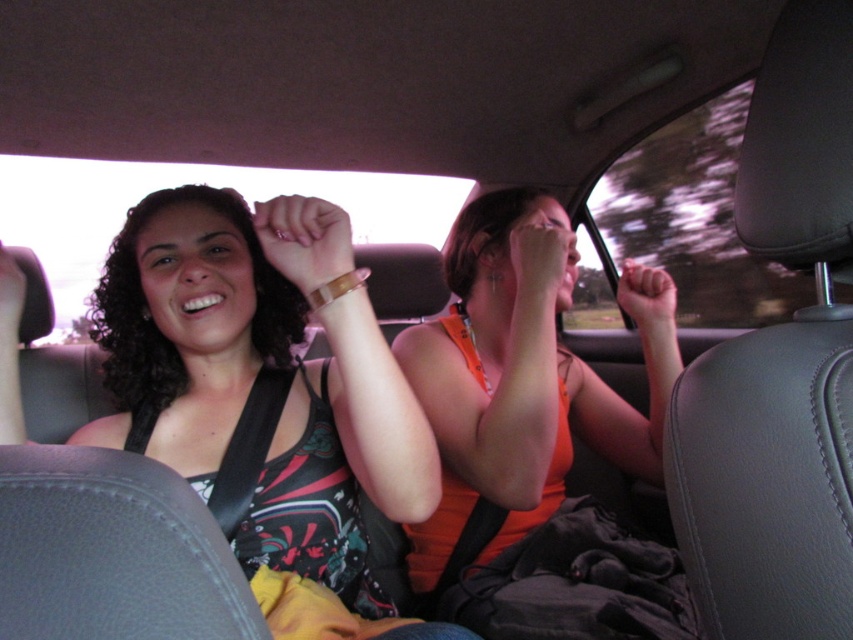
Question: Among these points, which one is farthest from the camera?

Choices:
 (A) (531, 420)
 (B) (277, 554)

Answer: (A)

Question: Which point is farther from the camera taking this photo?

Choices:
 (A) (236, 324)
 (B) (482, 355)
 (C) (271, 218)
 (D) (675, 289)

Answer: (D)

Question: Which point is farther to the camera?

Choices:
 (A) (642, 278)
 (B) (511, 380)
 (C) (7, 259)
 (D) (297, 250)

Answer: (A)

Question: Is the position of orange fabric tank top at center more distant than that of matte orange hand at center?

Choices:
 (A) yes
 (B) no

Answer: (B)

Question: Is matte black tank top at center above matte brown bracelet at center?

Choices:
 (A) yes
 (B) no

Answer: (B)

Question: Does matte brown bracelet at center come in front of matte orange hand at center?

Choices:
 (A) yes
 (B) no

Answer: (A)